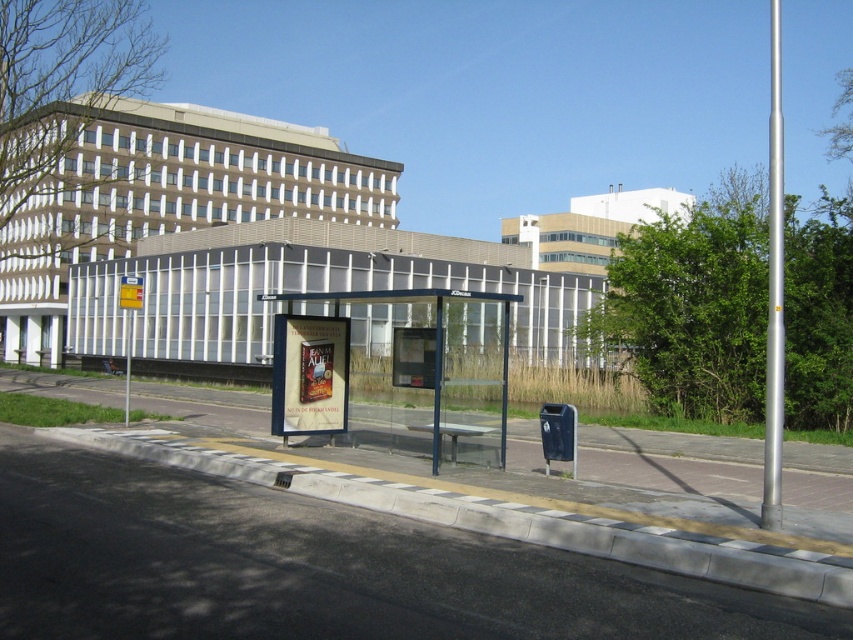
You are a delivery person carrying a heavy package and need to step over the gray concrete curb at lower center to reach the transparent glass bus stop at center. Can you step over the curb without dropping the package?

The gray concrete curb at lower center is not as tall as the transparent glass bus stop at center, so the curb is lower. Since the curb is lower, you can safely step over it without dropping the package.

Consider the image. You are a delivery person standing on the sidewalk near the gray concrete curb at lower center. You need to place a package inside the transparent glass bus stop at center. Can you walk directly to the bus stop without stepping over any obstacles?

The gray concrete curb at lower center is in front of the transparent glass bus stop at center, so you must step over the curb to reach the bus stop. Therefore, you cannot walk directly to the bus stop without stepping over an obstacle.